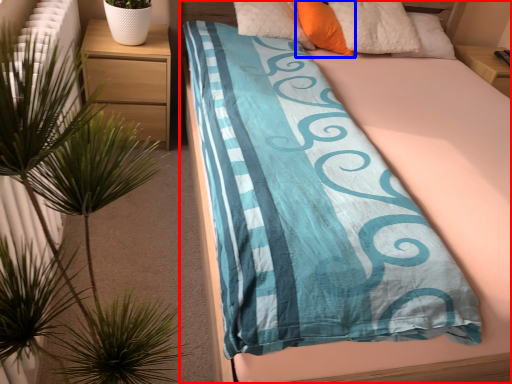
Question: Which object is closer to the camera taking this photo, bed (highlighted by a red box) or pillow (highlighted by a blue box)?

Choices:
 (A) bed
 (B) pillow

Answer: (A)